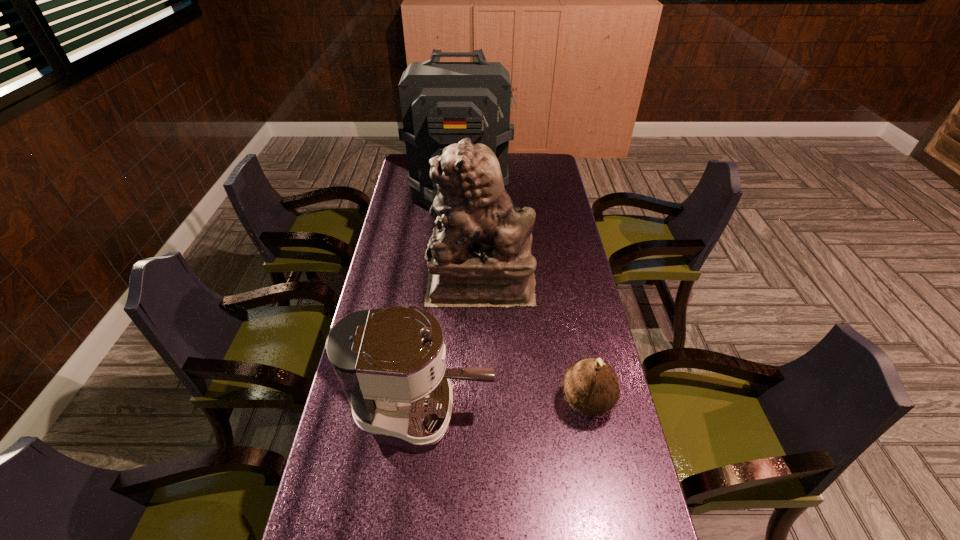
This screenshot has width=960, height=540. I want to click on empty location between the second farthest object and the rightmost object, so click(534, 342).

Where is `free point between the third tallest object and the rightmost object`? Image resolution: width=960 pixels, height=540 pixels. free point between the third tallest object and the rightmost object is located at coordinates (505, 405).

Where is `vacant space in between the sculpture and the coconut`? vacant space in between the sculpture and the coconut is located at coordinates (534, 342).

Where is `free space between the sculpture and the third tallest object`? The width and height of the screenshot is (960, 540). free space between the sculpture and the third tallest object is located at coordinates (451, 346).

Locate an element on the screen. The height and width of the screenshot is (540, 960). object that is the third nearest to the coffee maker is located at coordinates (442, 103).

Locate an element on the screen. The height and width of the screenshot is (540, 960). object identified as the closest to the coconut is located at coordinates (390, 363).

This screenshot has height=540, width=960. What are the coordinates of `free space that satisfies the following two spatial constraints: 1. on the front compartment of the backpack; 2. on the front-facing side of the coffee maker` in the screenshot? It's located at (x=447, y=409).

Find the location of a particular element. This screenshot has height=540, width=960. vacant space that satisfies the following two spatial constraints: 1. on the front compartment of the backpack; 2. on the front-facing side of the second shortest object is located at coordinates (447, 409).